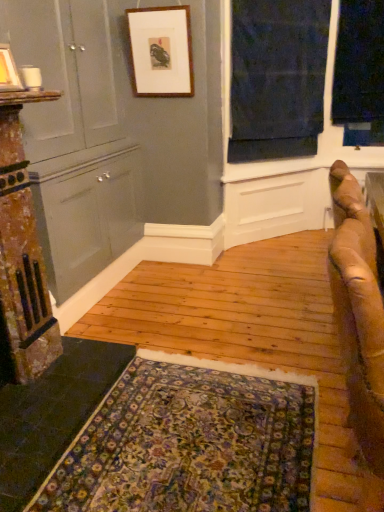
Question: Relative to dark blue fabric at upper right, is floral carpet at lower center in front or behind?

Choices:
 (A) front
 (B) behind

Answer: (A)

Question: From a real-world perspective, is floral carpet at lower center positioned above or below dark blue fabric at upper right?

Choices:
 (A) above
 (B) below

Answer: (B)

Question: Which is farther from the dark blue fabric at upper right?

Choices:
 (A) matte white picture frame at upper left, arranged as the second picture frame when viewed from the right
 (B) wooden picture frame at upper center, the second picture frame ordered from the bottom
 (C) brown leather couch at right
 (D) matte gray dresser at left
 (E) floral carpet at lower center

Answer: (E)

Question: Considering the real-world distances, which object is farthest from the brown leather couch at right?

Choices:
 (A) matte gray dresser at left
 (B) wooden picture frame at upper center, arranged as the 1th picture frame when viewed from the back
 (C) floral carpet at lower center
 (D) matte white picture frame at upper left, which is the 2th picture frame from back to front
 (E) dark blue fabric at upper right

Answer: (E)